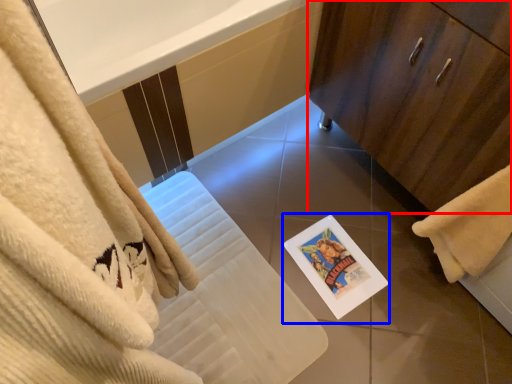
Question: Which object appears farthest to the camera in this image, bathroom cabinet (highlighted by a red box) or postcard (highlighted by a blue box)?

Choices:
 (A) bathroom cabinet
 (B) postcard

Answer: (B)